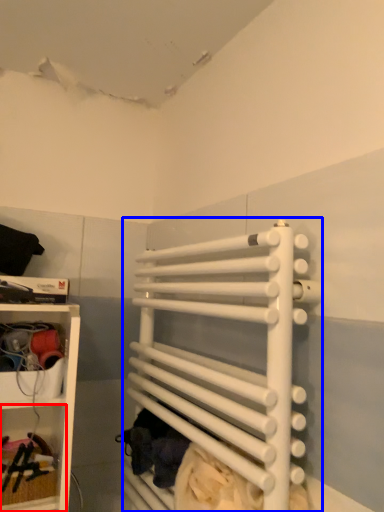
Question: Which object appears farthest to the camera in this image, cabinet (highlighted by a red box) or bunk bed (highlighted by a blue box)?

Choices:
 (A) cabinet
 (B) bunk bed

Answer: (A)